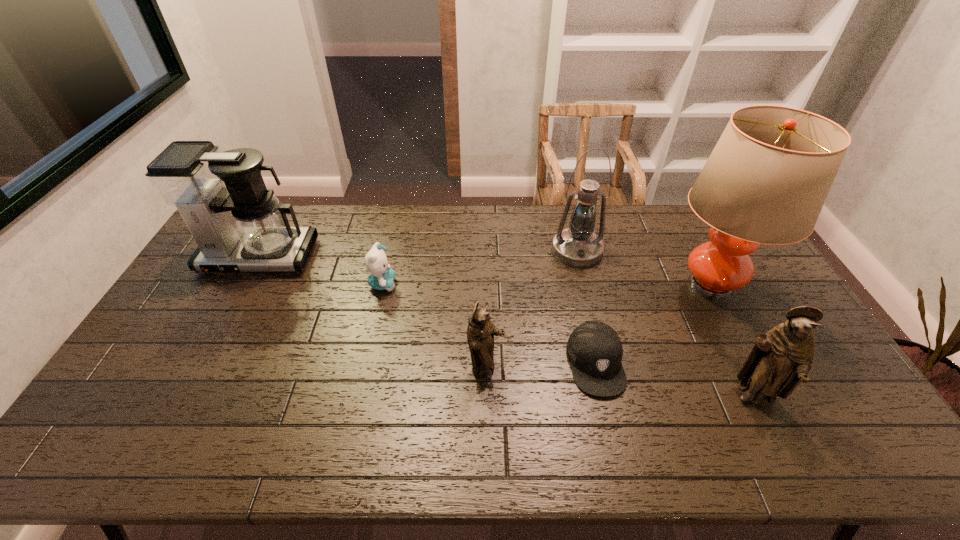
Locate an element on the screen. vacant area situated 0.260m on the front-facing side of the fifth tallest object is located at coordinates (599, 369).

You are a GUI agent. You are given a task and a screenshot of the screen. Output one action in this format:
    pyautogui.click(x=<x>, y=<y>)
    Task: Click on the free location located 0.390m on the face of the kitten
    
    Given the screenshot: What is the action you would take?
    pyautogui.click(x=516, y=284)

Find the location of a particular element. free space located on the right of the oil lamp is located at coordinates (715, 251).

The height and width of the screenshot is (540, 960). What are the coordinates of `blank area located 0.310m at the front of the coffee maker where the controls are located` in the screenshot? It's located at pos(204,356).

Locate an element on the screen. The image size is (960, 540). free space located 0.070m on the left of the tallest object is located at coordinates [640, 285].

The image size is (960, 540). Identify the location of oil lamp at the far edge. (577, 246).

Where is `coffee maker that is at the far edge`? This screenshot has width=960, height=540. coffee maker that is at the far edge is located at coordinates (242, 227).

At what (x,y) coordinates should I click in order to perform the action: click on figurine that is positioned at the near edge. Please return your answer as a coordinate pair (x, y). The image size is (960, 540). Looking at the image, I should click on (781, 359).

The width and height of the screenshot is (960, 540). I want to click on cap at the near edge, so click(595, 351).

In order to click on object that is positioned at the left edge in this screenshot , I will do `click(242, 227)`.